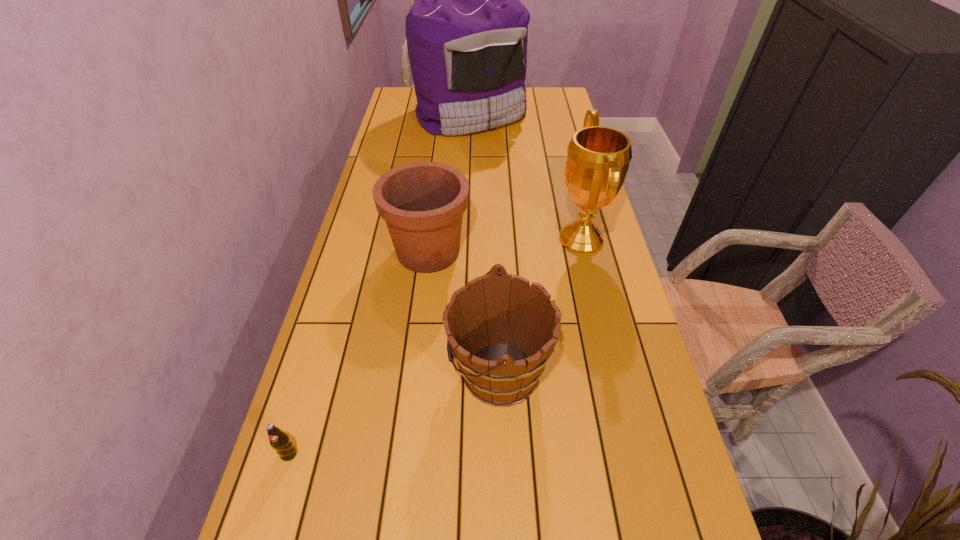
I want to click on free space located 0.340m on the front-facing side of the fourth shortest object, so click(x=443, y=239).

This screenshot has width=960, height=540. What are the coordinates of `vacant region located 0.110m on the front-facing side of the fourth shortest object` in the screenshot? It's located at coord(517,239).

Where is `free region located 0.290m with the handle on the wine bucket`? The image size is (960, 540). free region located 0.290m with the handle on the wine bucket is located at coordinates (323, 372).

Locate an element on the screen. The image size is (960, 540). vacant space located with the handle on the wine bucket is located at coordinates (361, 372).

Identify the location of free space located with the handle on the wine bucket. This screenshot has height=540, width=960. (396, 372).

The height and width of the screenshot is (540, 960). Identify the location of free space located 0.400m on the right of the flowerpot. (606, 252).

Identify the location of free space located 0.080m on the front label of the shortest object. (274, 505).

This screenshot has height=540, width=960. I want to click on object present at the far edge, so click(x=467, y=33).

Locate an element on the screen. backpack located in the left edge section of the desktop is located at coordinates (467, 33).

Identify the location of flowerpot that is at the left edge. The width and height of the screenshot is (960, 540). (422, 203).